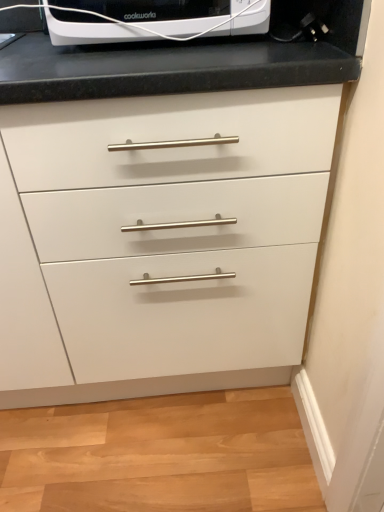
Question: From the image's perspective, is white glossy appliance at upper center positioned above or below white matte cabinet at center?

Choices:
 (A) above
 (B) below

Answer: (A)

Question: Is white glossy appliance at upper center in front of or behind white matte cabinet at center in the image?

Choices:
 (A) front
 (B) behind

Answer: (B)

Question: From a real-world perspective, is white glossy appliance at upper center physically located above or below white matte cabinet at center?

Choices:
 (A) above
 (B) below

Answer: (A)

Question: In terms of width, does white matte cabinet at center look wider or thinner when compared to white glossy appliance at upper center?

Choices:
 (A) thin
 (B) wide

Answer: (B)

Question: From a real-world perspective, is white matte cabinet at center positioned above or below white glossy appliance at upper center?

Choices:
 (A) below
 (B) above

Answer: (A)

Question: From the image's perspective, is white matte cabinet at center above or below white glossy appliance at upper center?

Choices:
 (A) below
 (B) above

Answer: (A)

Question: In the image, is white matte cabinet at center on the left side or the right side of white glossy appliance at upper center?

Choices:
 (A) right
 (B) left

Answer: (B)